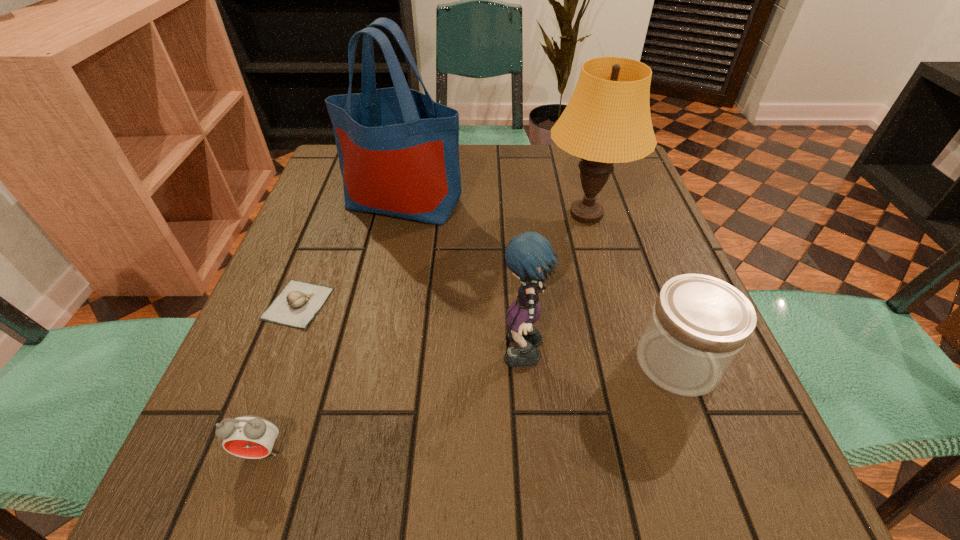
What are the coordinates of `handbag` in the screenshot? It's located at (398, 150).

Identify the location of the fifth shortest object. (607, 120).

Locate an element on the screen. the third tallest object is located at coordinates (530, 256).

You are a GUI agent. You are given a task and a screenshot of the screen. Output one action in this format:
    pyautogui.click(x=<x>, y=<y>)
    Task: Click on the rag doll
    
    Given the screenshot: What is the action you would take?
    pyautogui.click(x=530, y=256)

You are a GUI agent. You are given a task and a screenshot of the screen. Output one action in this format:
    pyautogui.click(x=<x>, y=<y>)
    Task: Click on the jar
    The width and height of the screenshot is (960, 540).
    Given the screenshot: What is the action you would take?
    pyautogui.click(x=699, y=324)

This screenshot has width=960, height=540. Identify the location of the nearest object. point(247,436).

Where is `the fifth tallest object`? the fifth tallest object is located at coordinates (247, 436).

Identify the location of garlic. The height and width of the screenshot is (540, 960). (298, 303).

Where is `vacant region located 0.350m on the front of the handbag`? vacant region located 0.350m on the front of the handbag is located at coordinates (372, 354).

Find the location of a particular element. vacant space located on the front of the lampshade is located at coordinates (627, 358).